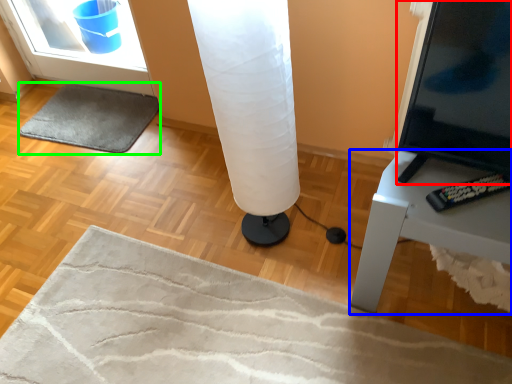
Question: Which object is positioned farthest from screen (highlighted by a red box)? Select from furniture (highlighted by a blue box) and yoga mat (highlighted by a green box).

Choices:
 (A) furniture
 (B) yoga mat

Answer: (B)